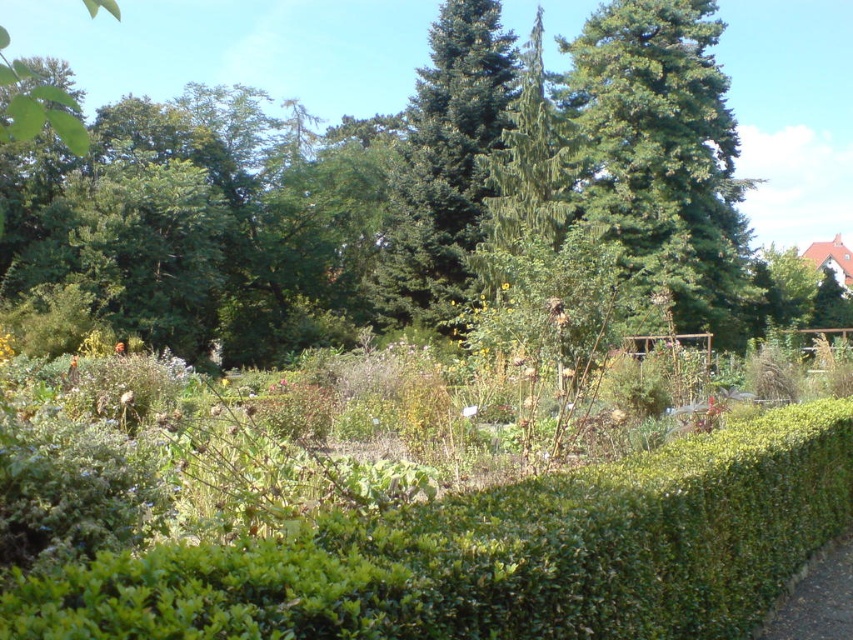
Consider the image. You are standing in the garden and want to place a small statue between the two points, point (178, 627) and point (721, 218). Which point should the statue be closer to if you want it to be more visible from where you are standing?

The statue should be placed closer to point (178, 627) because it is closer to the camera, making it more visible from your current position.